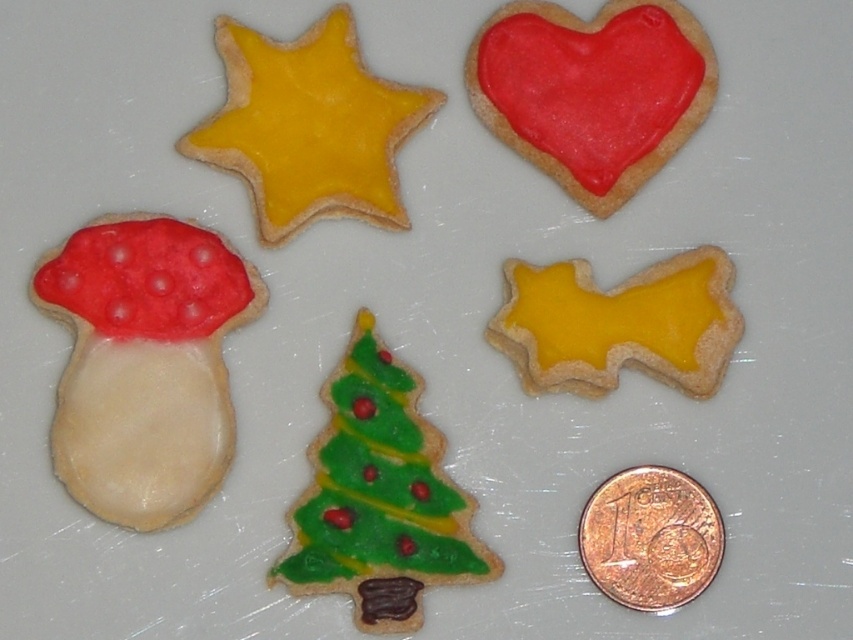
Question: Which object appears closest to the camera in this image?

Choices:
 (A) yellow matte star at upper left
 (B) matte white mushroom at left
 (C) red glossy heart at upper right

Answer: (B)

Question: Is matte white mushroom at left positioned at the back of yellow matte gingerbread at upper right?

Choices:
 (A) no
 (B) yes

Answer: (A)

Question: Among these objects, which one is farthest from the camera?

Choices:
 (A) yellow matte gingerbread at upper right
 (B) copper metallic coin at lower right
 (C) matte white mushroom at left

Answer: (A)

Question: Which object appears farthest from the camera in this image?

Choices:
 (A) yellow matte star at upper left
 (B) red glossy heart at upper right
 (C) matte white mushroom at left

Answer: (A)

Question: In this image, where is matte white mushroom at left located relative to red glossy heart at upper right?

Choices:
 (A) below
 (B) above

Answer: (A)

Question: Is matte white mushroom at left behind green matte christmas tree at center?

Choices:
 (A) yes
 (B) no

Answer: (A)